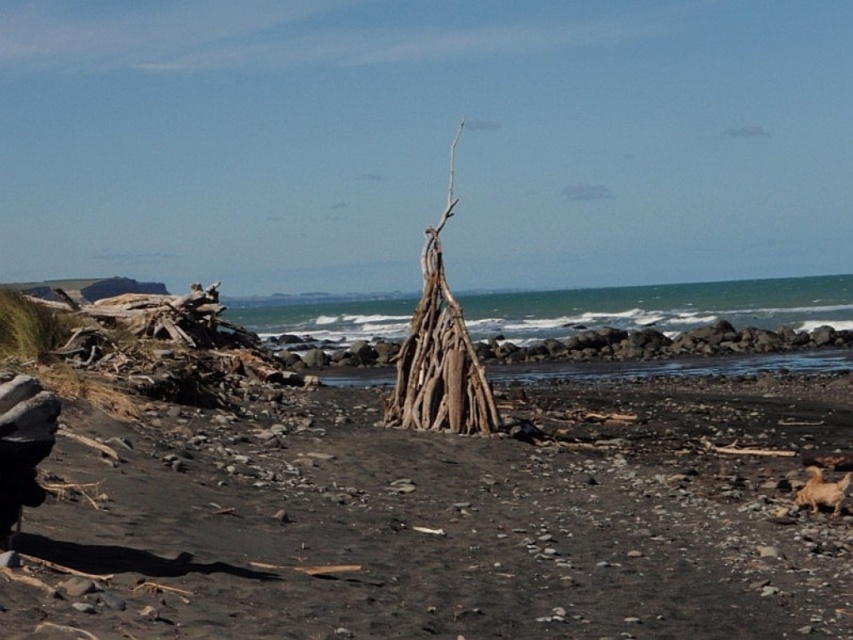
Question: Where is dark sand at center located in relation to brown driftwood structure at center in the image?

Choices:
 (A) left
 (B) right

Answer: (A)

Question: Which object appears closest to the camera in this image?

Choices:
 (A) dark sand at center
 (B) brown driftwood structure at center

Answer: (A)

Question: Can you confirm if dark sand at center is positioned above brown driftwood structure at center?

Choices:
 (A) yes
 (B) no

Answer: (B)

Question: Considering the relative positions of dark sand at center and brown driftwood structure at center in the image provided, where is dark sand at center located with respect to brown driftwood structure at center?

Choices:
 (A) left
 (B) right

Answer: (A)

Question: Which of the following is the farthest from the observer?

Choices:
 (A) brown driftwood structure at center
 (B) dark sand at center

Answer: (A)

Question: Which object is closer to the camera taking this photo?

Choices:
 (A) dark sand at center
 (B) brown driftwood structure at center

Answer: (A)